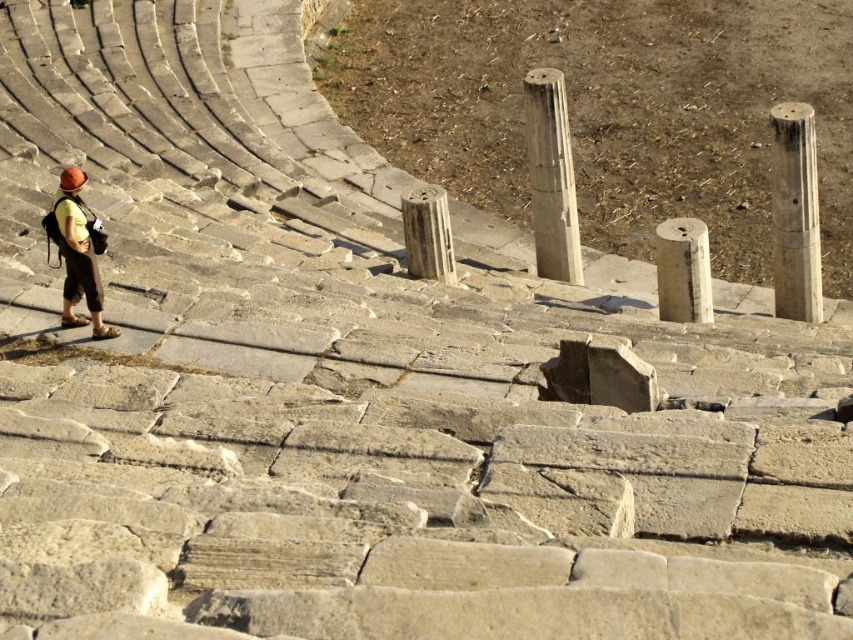
Question: Which point is closer to the camera?

Choices:
 (A) gray stone column at center
 (B) smooth stone column at center
 (C) gray stone pillar at right
 (D) matte yellow shirt at lower left

Answer: (D)

Question: Does matte yellow shirt at lower left have a greater width compared to gray stone column at center?

Choices:
 (A) yes
 (B) no

Answer: (A)

Question: Is gray stone pillar at right to the right of gray stone column at center from the viewer's perspective?

Choices:
 (A) no
 (B) yes

Answer: (B)

Question: Which point appears farthest from the camera in this image?

Choices:
 (A) (444, 257)
 (B) (817, 291)

Answer: (A)

Question: Among these points, which one is farthest from the camera?

Choices:
 (A) (535, 264)
 (B) (85, 273)
 (C) (792, 289)
 (D) (416, 216)

Answer: (A)

Question: Is matte yellow shirt at lower left positioned in front of smooth gray pillar at center-right?

Choices:
 (A) yes
 (B) no

Answer: (A)